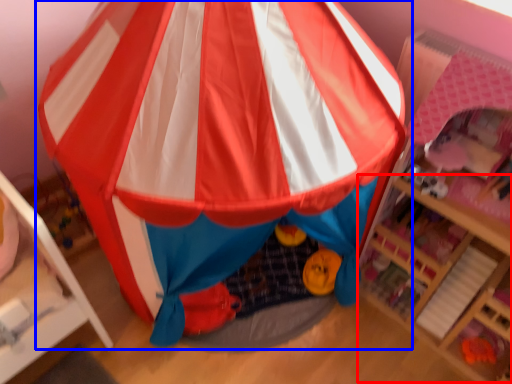
Question: Which object appears closest to the camera in this image, shelf (highlighted by a red box) or tent (highlighted by a blue box)?

Choices:
 (A) shelf
 (B) tent

Answer: (B)